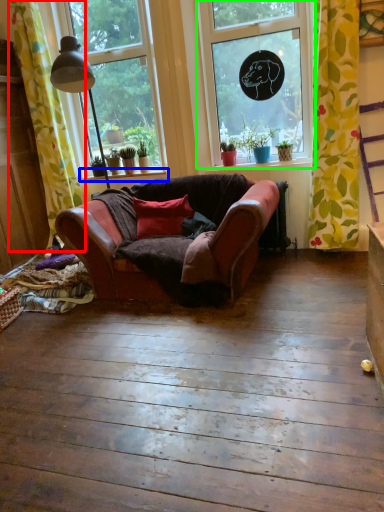
Question: Based on their relative distances, which object is farther from curtain (highlighted by a red box)? Choose from window sill (highlighted by a blue box) and window (highlighted by a green box).

Choices:
 (A) window sill
 (B) window

Answer: (B)